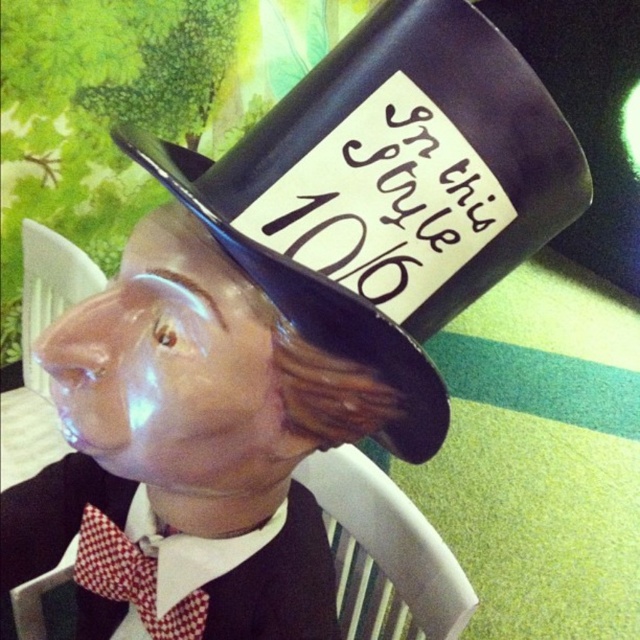
Can you confirm if black glossy top hat at center is positioned to the left of red checkered fabric tie at center?

In fact, black glossy top hat at center is to the right of red checkered fabric tie at center.

Who is taller, black glossy top hat at center or red checkered fabric tie at center?

black glossy top hat at center

Who is more distant from viewer, [323,248] or [104,570]?

The point [104,570] is behind.

Image resolution: width=640 pixels, height=640 pixels. Find the location of `black glossy top hat at center`. black glossy top hat at center is located at coordinates (388, 192).